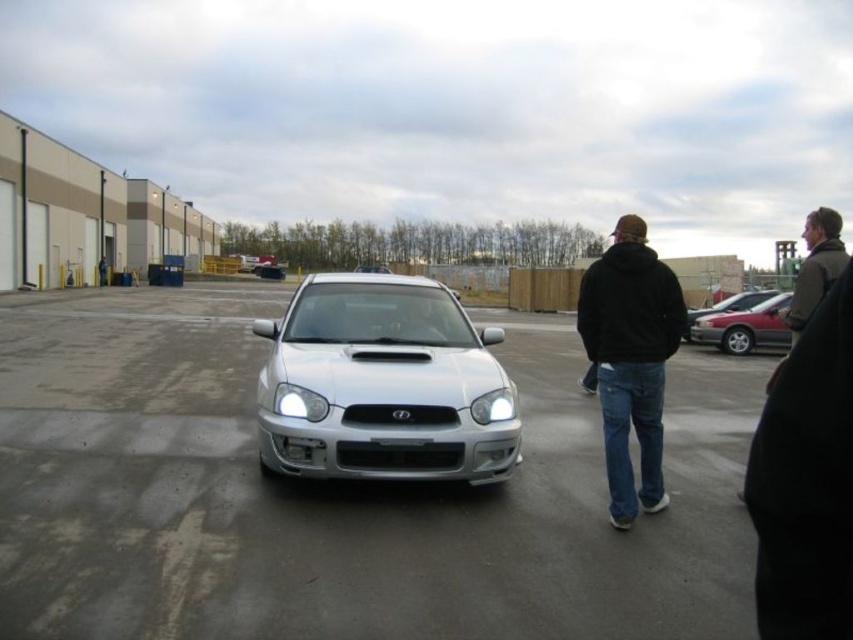
Question: Among these objects, which one is farthest from the camera?

Choices:
 (A) white plastic license plate at center
 (B) silver metallic hatchback at center

Answer: (B)

Question: Among these points, which one is nearest to the camera?

Choices:
 (A) (657, 424)
 (B) (347, 323)

Answer: (A)

Question: Can you confirm if silver metallic car at center is positioned below silver metallic hatchback at center?

Choices:
 (A) no
 (B) yes

Answer: (B)

Question: Which of the following is the farthest from the observer?

Choices:
 (A) silver metallic car at center
 (B) silver metallic hatchback at center

Answer: (B)

Question: Does black fleece jacket at center have a greater width compared to white plastic license plate at center?

Choices:
 (A) no
 (B) yes

Answer: (B)

Question: Can you confirm if silver metallic hatchback at center is positioned to the right of black fleece jacket at center?

Choices:
 (A) no
 (B) yes

Answer: (A)